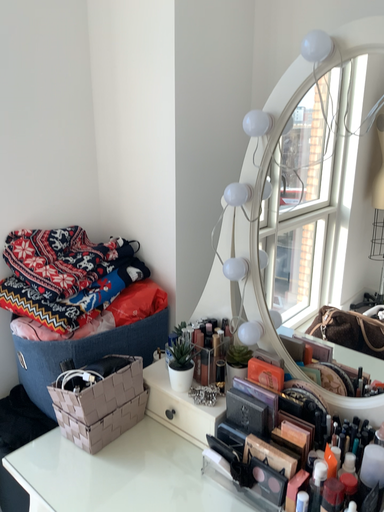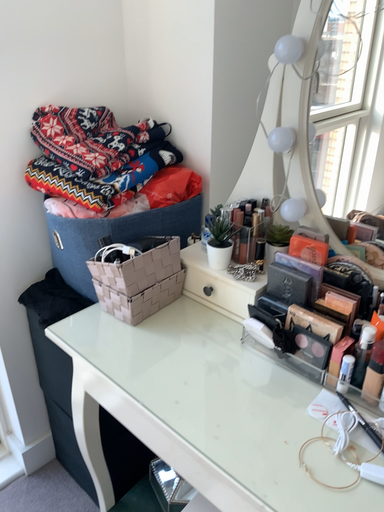
Question: How did the camera likely rotate when shooting the video?

Choices:
 (A) rotated upward
 (B) rotated downward

Answer: (B)